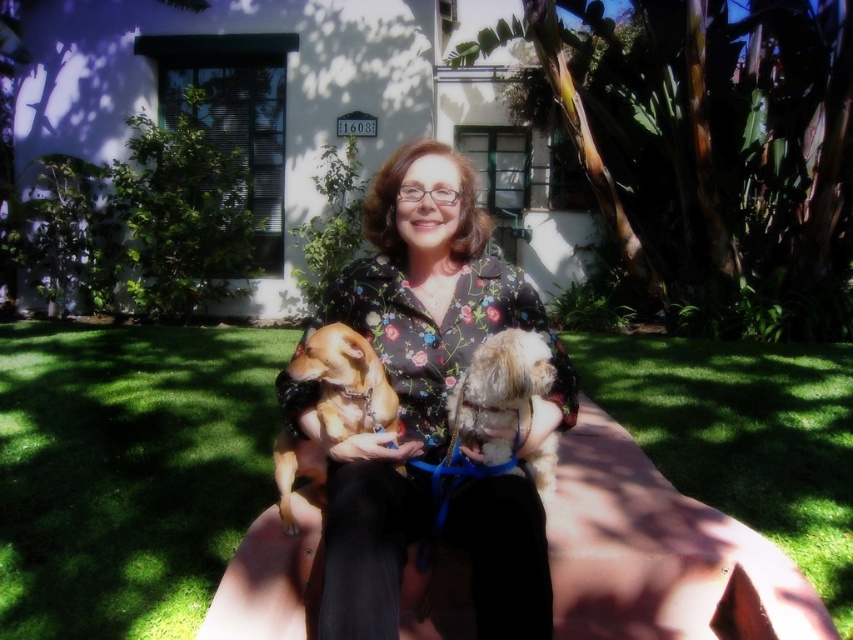
Question: Is floral-patterned blouse at center smaller than golden brown fur at center?

Choices:
 (A) no
 (B) yes

Answer: (A)

Question: Which point is farther to the camera?

Choices:
 (A) fluffy beige dog at center
 (B) golden brown fur at center

Answer: (B)

Question: Which point is closer to the camera taking this photo?

Choices:
 (A) (527, 454)
 (B) (543, 611)

Answer: (B)

Question: Which object is the closest to the floral-patterned blouse at center?

Choices:
 (A) fluffy beige dog at center
 (B) golden brown fur at center

Answer: (A)

Question: Can you confirm if floral-patterned blouse at center is thinner than fluffy beige dog at center?

Choices:
 (A) yes
 (B) no

Answer: (B)

Question: Is floral-patterned blouse at center wider than fluffy beige dog at center?

Choices:
 (A) yes
 (B) no

Answer: (A)